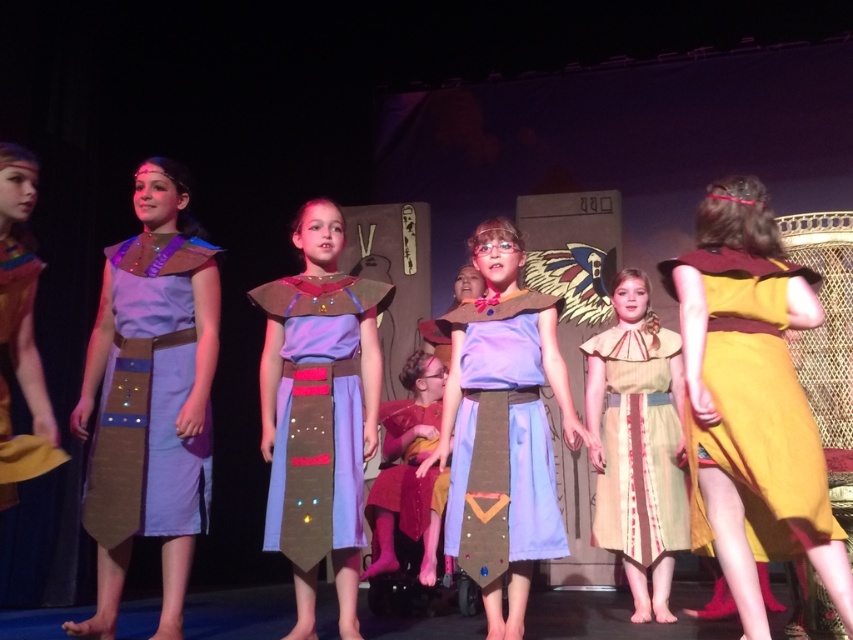
Based on the photo, does matte blue fabric dress at center appear on the right side of matte purple fabric dress at left?

Yes, matte blue fabric dress at center is to the right of matte purple fabric dress at left.

Is matte blue fabric dress at center positioned at the back of matte purple fabric dress at left?

Yes, it is behind matte purple fabric dress at left.

Between point (532, 525) and point (16, 333), which one is positioned behind?

Point (532, 525)

Identify the location of matte blue fabric dress at center. (502, 442).

Which is below, matte blue fabric dress at center or light purple fabric dress at center?

matte blue fabric dress at center is below.

Does matte blue fabric dress at center appear over light purple fabric dress at center?

No, matte blue fabric dress at center is not above light purple fabric dress at center.

Who is more forward, (520, 518) or (354, 371)?

Positioned in front is point (520, 518).

Where is `matte blue fabric dress at center`? The height and width of the screenshot is (640, 853). matte blue fabric dress at center is located at coordinates (502, 442).

Can you confirm if matte purple fabric dress at center is thinner than light purple fabric dress at center?

Indeed, matte purple fabric dress at center has a lesser width compared to light purple fabric dress at center.

The height and width of the screenshot is (640, 853). What are the coordinates of `matte purple fabric dress at center` in the screenshot? It's located at (149, 397).

Image resolution: width=853 pixels, height=640 pixels. What are the coordinates of `matte purple fabric dress at center` in the screenshot? It's located at (149, 397).